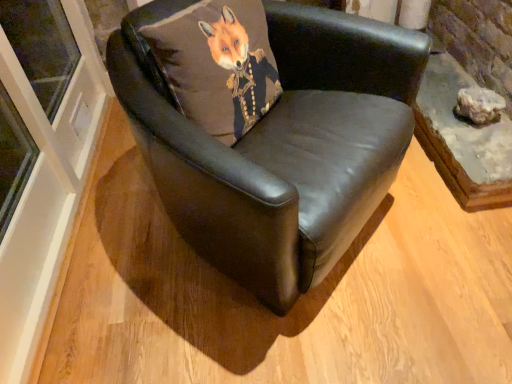
Question: Is black leather chair at center positioned with its back to matte gray rock at right?

Choices:
 (A) yes
 (B) no

Answer: (B)

Question: Does black leather chair at center have a lesser width compared to matte gray rock at right?

Choices:
 (A) yes
 (B) no

Answer: (B)

Question: Is black leather chair at center smaller than matte gray rock at right?

Choices:
 (A) yes
 (B) no

Answer: (B)

Question: Considering the relative positions of black leather chair at center and matte gray rock at right in the image provided, is black leather chair at center in front of matte gray rock at right?

Choices:
 (A) yes
 (B) no

Answer: (A)

Question: Can you confirm if black leather chair at center is taller than matte gray rock at right?

Choices:
 (A) no
 (B) yes

Answer: (B)

Question: Could you tell me if black leather chair at center is turned towards matte gray rock at right?

Choices:
 (A) yes
 (B) no

Answer: (B)

Question: Considering the relative positions of matte gray rock at right and black leather chair at center in the image provided, is matte gray rock at right behind black leather chair at center?

Choices:
 (A) yes
 (B) no

Answer: (A)

Question: Is matte gray rock at right to the right of black leather chair at center from the viewer's perspective?

Choices:
 (A) no
 (B) yes

Answer: (B)

Question: From a real-world perspective, does matte gray rock at right stand above black leather chair at center?

Choices:
 (A) no
 (B) yes

Answer: (A)

Question: Is black leather chair at center located within matte gray rock at right?

Choices:
 (A) yes
 (B) no

Answer: (B)

Question: Is matte gray rock at right closer to the viewer compared to black leather chair at center?

Choices:
 (A) no
 (B) yes

Answer: (A)

Question: From the image's perspective, is matte gray rock at right located above black leather chair at center?

Choices:
 (A) yes
 (B) no

Answer: (A)

Question: Considering the relative positions of matte gray rock at right and matte brown cushion at center in the image provided, is matte gray rock at right to the right of matte brown cushion at center from the viewer's perspective?

Choices:
 (A) no
 (B) yes

Answer: (B)